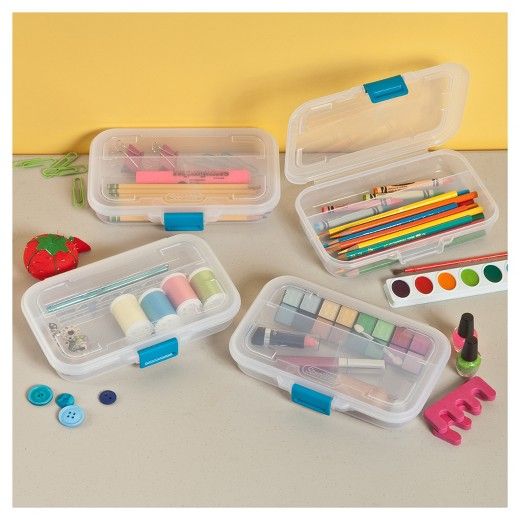
Identify the location of crayon. (406, 183), (398, 192), (359, 202), (333, 216).